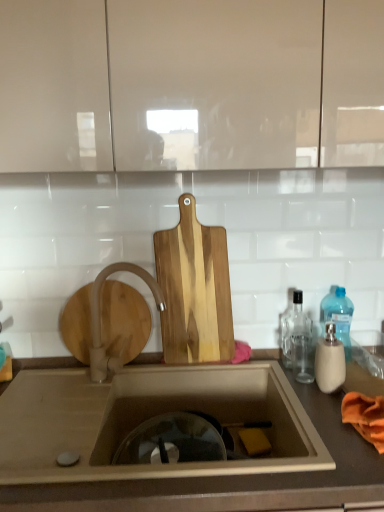
Question: Is transparent glass bottle at right, the 2th bottle when ordered from front to back, positioned before matte white cabinet at upper center?

Choices:
 (A) yes
 (B) no

Answer: (B)

Question: Can you confirm if transparent glass bottle at right, which ranks as the 2th bottle in back-to-front order, is thinner than matte white cabinet at upper center?

Choices:
 (A) yes
 (B) no

Answer: (A)

Question: Is transparent glass bottle at right, which ranks as the 2th bottle in back-to-front order, further to camera compared to matte white cabinet at upper center?

Choices:
 (A) yes
 (B) no

Answer: (A)

Question: From the image's perspective, does transparent glass bottle at right, which ranks as the 2th bottle in back-to-front order, appear lower than matte white cabinet at upper center?

Choices:
 (A) no
 (B) yes

Answer: (B)

Question: Is transparent glass bottle at right, the 2th bottle when ordered from front to back, shorter than matte white cabinet at upper center?

Choices:
 (A) yes
 (B) no

Answer: (A)

Question: From a real-world perspective, is blue translucent bottle at right, the 1th bottle in the back-to-front sequence, above or below natural wood cutting board at center?

Choices:
 (A) above
 (B) below

Answer: (B)

Question: Which is correct: blue translucent bottle at right, the 3th bottle when ordered from front to back, is inside natural wood cutting board at center, or outside of it?

Choices:
 (A) inside
 (B) outside

Answer: (B)

Question: From the image's perspective, relative to natural wood cutting board at center, is blue translucent bottle at right, the 3th bottle when ordered from front to back, above or below?

Choices:
 (A) above
 (B) below

Answer: (B)

Question: Is blue translucent bottle at right, the 1th bottle in the back-to-front sequence, wider or thinner than natural wood cutting board at center?

Choices:
 (A) thin
 (B) wide

Answer: (B)

Question: Looking at the image, does brown matte countertop at lower center seem bigger or smaller compared to matte white cabinet at upper center?

Choices:
 (A) big
 (B) small

Answer: (A)

Question: Is brown matte countertop at lower center to the left or to the right of matte white cabinet at upper center in the image?

Choices:
 (A) left
 (B) right

Answer: (B)

Question: Does point (157, 505) appear closer or farther from the camera than point (160, 47)?

Choices:
 (A) farther
 (B) closer

Answer: (B)

Question: From the image's perspective, is brown matte countertop at lower center above or below matte white cabinet at upper center?

Choices:
 (A) above
 (B) below

Answer: (B)

Question: Visually, is white matte faucet at sink left positioned to the left or to the right of transparent glass bottle at right, which ranks as the 2th bottle in back-to-front order?

Choices:
 (A) right
 (B) left

Answer: (B)

Question: From the image's perspective, is white matte faucet at sink left located above or below transparent glass bottle at right, which ranks as the 2th bottle in back-to-front order?

Choices:
 (A) below
 (B) above

Answer: (B)